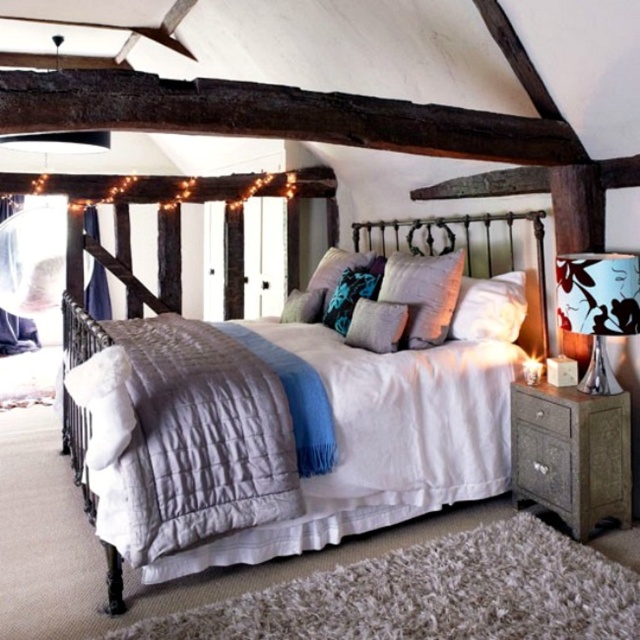
Does quilted fabric bed at center appear on the left side of white soft pillow at center?

Indeed, quilted fabric bed at center is positioned on the left side of white soft pillow at center.

This screenshot has width=640, height=640. What do you see at coordinates (323, 522) in the screenshot?
I see `quilted fabric bed at center` at bounding box center [323, 522].

Identify the location of quilted fabric bed at center. This screenshot has height=640, width=640. (323, 522).

Is velvet cushion at center in front of textured gray pillow at center?

No, it is behind textured gray pillow at center.

Which is more to the right, velvet cushion at center or textured gray pillow at center?

velvet cushion at center is more to the right.

What are the coordinates of `velvet cushion at center` in the screenshot? It's located at (422, 292).

Looking at this image, does white soft pillow at center have a lesser width compared to velvet floral pillow at center?

In fact, white soft pillow at center might be wider than velvet floral pillow at center.

Does white soft pillow at center appear on the right side of velvet floral pillow at center?

Correct, you'll find white soft pillow at center to the right of velvet floral pillow at center.

Locate an element on the screen. This screenshot has width=640, height=640. white soft pillow at center is located at coordinates (490, 307).

Find the location of a particular element. Image resolution: width=640 pixels, height=640 pixels. white soft pillow at center is located at coordinates (490, 307).